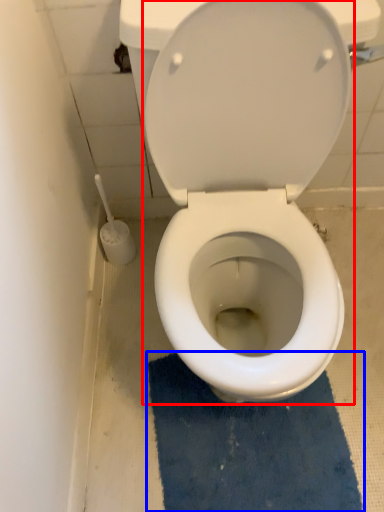
Question: Which of the following is the closest to the observer, toilet (highlighted by a red box) or bath mat (highlighted by a blue box)?

Choices:
 (A) toilet
 (B) bath mat

Answer: (A)